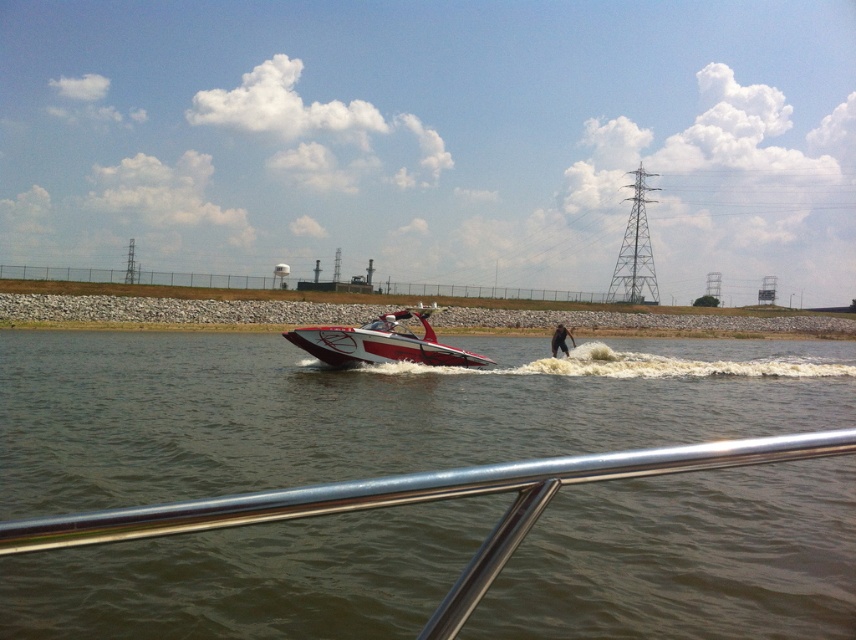
Question: Which is farther from the clear water at center?

Choices:
 (A) shiny red and white speedboat at center
 (B) black fabric pants at lower center

Answer: (B)

Question: Where is clear water at center located in relation to shiny red and white speedboat at center in the image?

Choices:
 (A) above
 (B) below

Answer: (B)

Question: Which object is positioned closest to the clear water at center?

Choices:
 (A) black fabric pants at lower center
 (B) shiny red and white speedboat at center

Answer: (B)

Question: Which object appears closest to the camera in this image?

Choices:
 (A) clear water at center
 (B) black fabric pants at lower center
 (C) shiny red and white speedboat at center

Answer: (A)

Question: Observing the image, what is the correct spatial positioning of clear water at center in reference to black fabric pants at lower center?

Choices:
 (A) left
 (B) right

Answer: (A)

Question: From the image, what is the correct spatial relationship of clear water at center in relation to black fabric pants at lower center?

Choices:
 (A) above
 (B) below

Answer: (B)